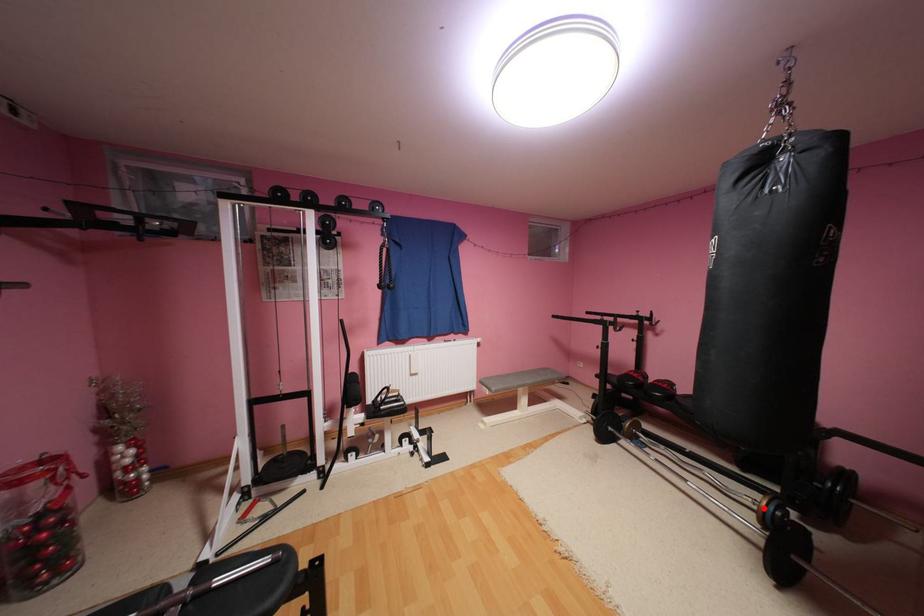
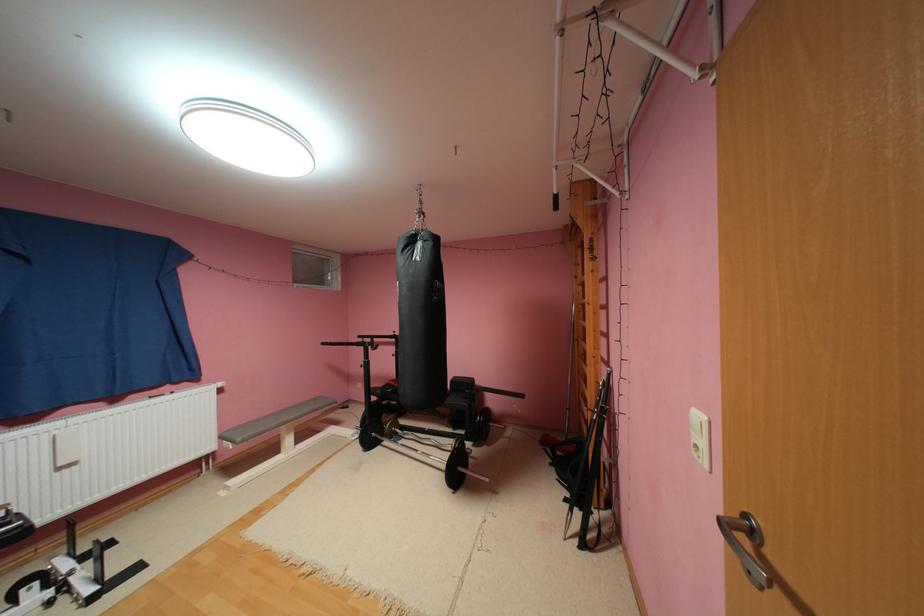
Question: I am providing you with two images of the same scene from different viewpoints. In image1, a red point is highlighted. Considering the same 3D point in image2, which of the following is correct?

Choices:
 (A) It is closer
 (B) It is farther

Answer: (A)